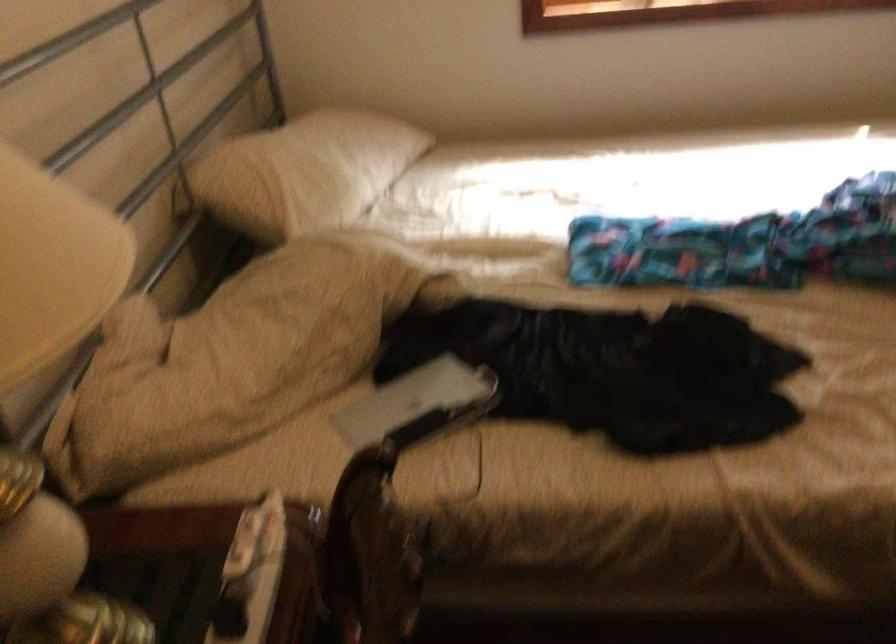
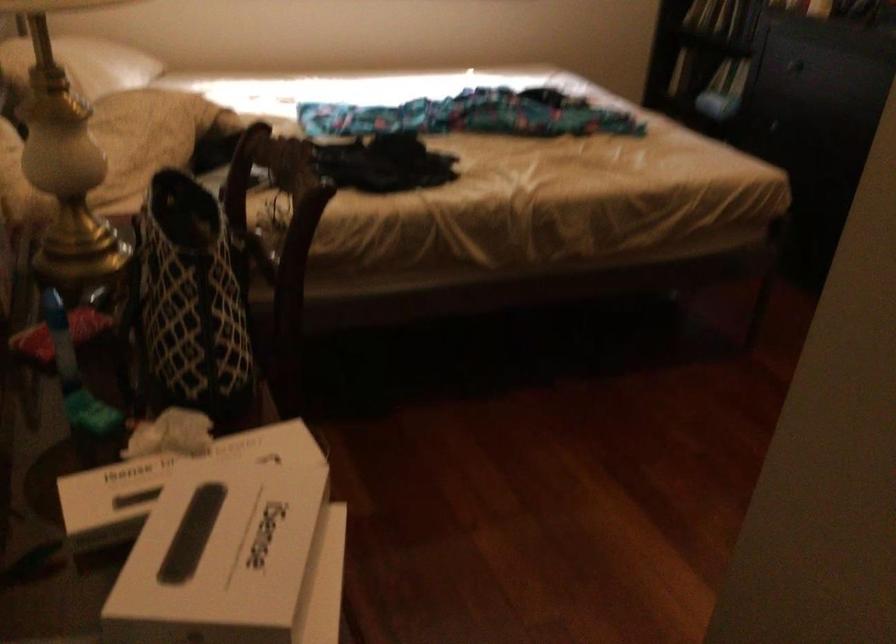
Locate, in the second image, the point that corresponds to [293,182] in the first image.

(82, 64)